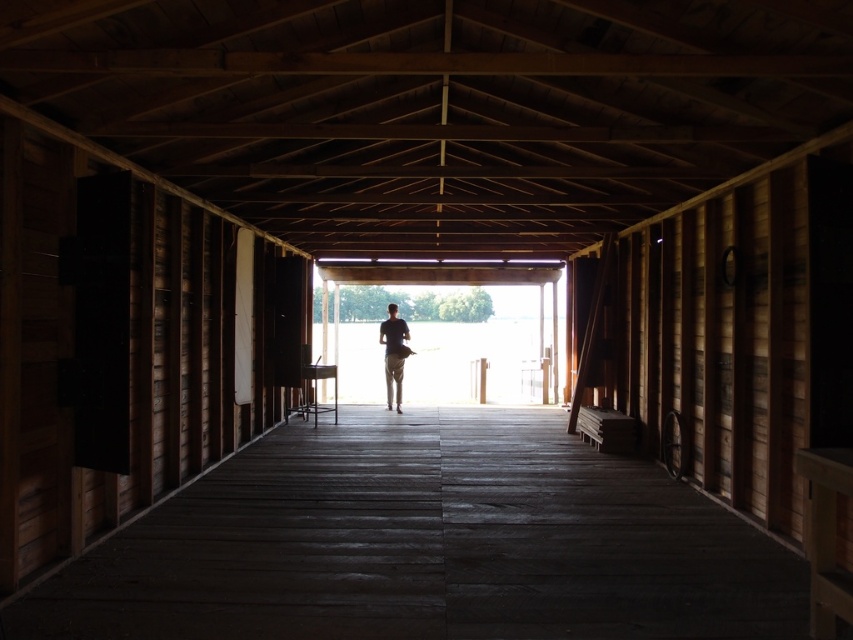
Question: Can you confirm if dark wood floor at center is smaller than dark gray fabric shirt at center?

Choices:
 (A) yes
 (B) no

Answer: (A)

Question: Is dark wood floor at center bigger than dark gray fabric shirt at center?

Choices:
 (A) no
 (B) yes

Answer: (A)

Question: Which point is farther to the camera?

Choices:
 (A) dark wood floor at center
 (B) dark gray fabric shirt at center

Answer: (B)

Question: Which object is closer to the camera taking this photo?

Choices:
 (A) dark wood floor at center
 (B) dark gray fabric shirt at center

Answer: (A)

Question: Does dark wood floor at center have a lesser width compared to dark gray fabric shirt at center?

Choices:
 (A) no
 (B) yes

Answer: (A)